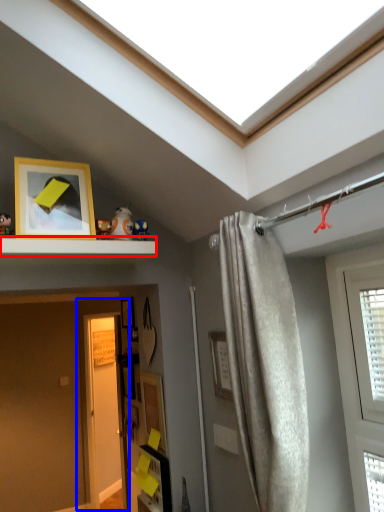
Question: Which object is closer to the camera taking this photo, shelf (highlighted by a red box) or door (highlighted by a blue box)?

Choices:
 (A) shelf
 (B) door

Answer: (A)